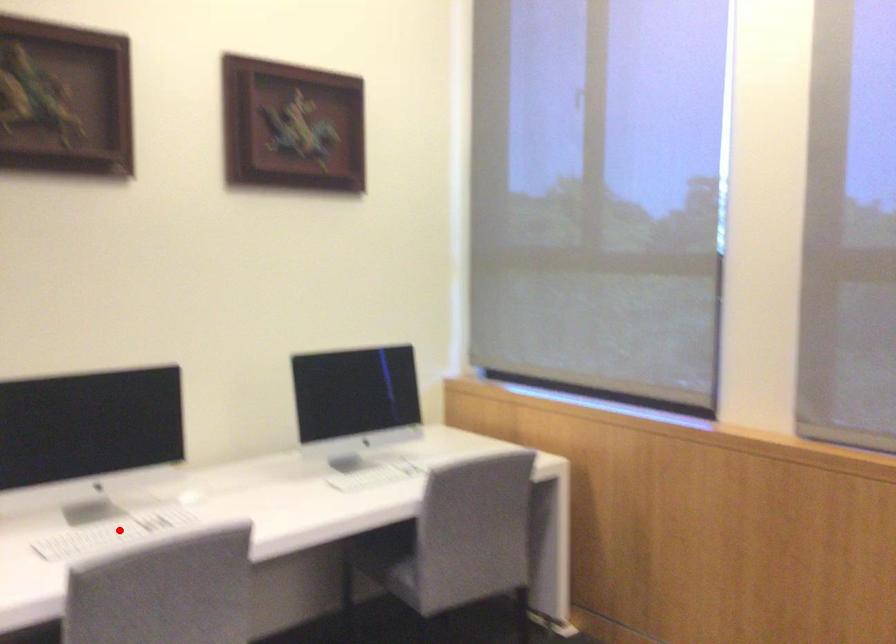
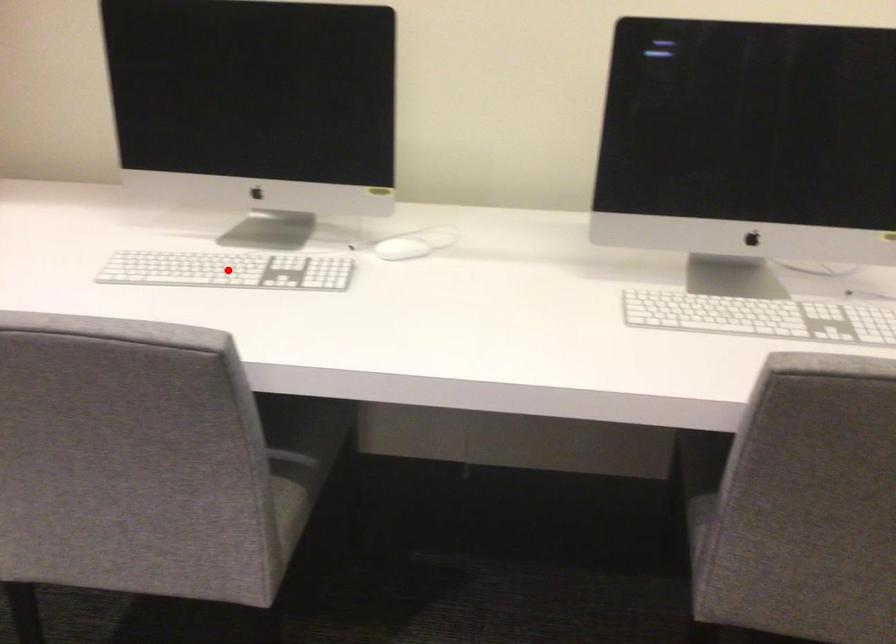
I am providing you with two images of the same scene from different viewpoints. A red point is marked on the first image and another point is marked on the second image. Are the points marked in image1 and image2 representing the same 3D position?

Yes